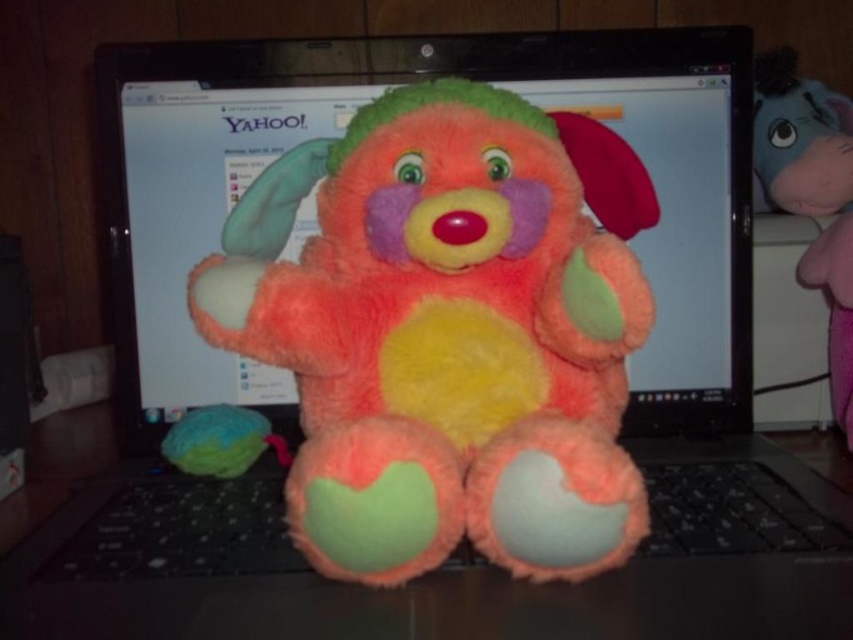
You are trying to take a screenshot of the Yahoo! webpage on the laptop screen. However, the fluffy multicolored stuffed animal at center and the pink plush elephant at right are blocking the view. Which object is closer to the camera and needs to be moved first to ensure the screenshot captures the entire webpage?

The fluffy multicolored stuffed animal at center is closer to the camera than the pink plush elephant at right, so you should move it first to capture the entire webpage.

You are organizing a small shelf to display the fluffy multicolored stuffed animal at center and the matte green plush ball at lower left. If the shelf has a height limit of 15 cm, can both items be placed on the shelf without exceeding the height restriction?

The fluffy multicolored stuffed animal at center is taller than the matte green plush ball at lower left. However, since the exact heights are not provided, we cannot determine if their combined height exceeds the 15 cm limit. Please check the individual heights of both items.

Consider the image. You are trying to place a small sticker on the laptop screen. There are two points marked on the screen at coordinates point (x=149, y=568) and point (x=767, y=81). Which point is closer to the edge of the screen?

Point (x=149, y=568) is closer to the edge of the screen because it is in front of point (x=767, y=81).